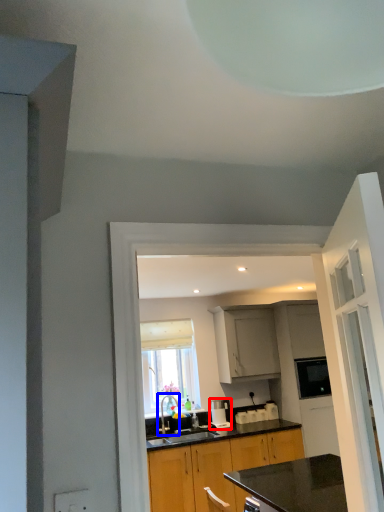
Question: Which point is further to the camera, coffee machine (highlighted by a red box) or tap (highlighted by a blue box)?

Choices:
 (A) coffee machine
 (B) tap

Answer: (A)